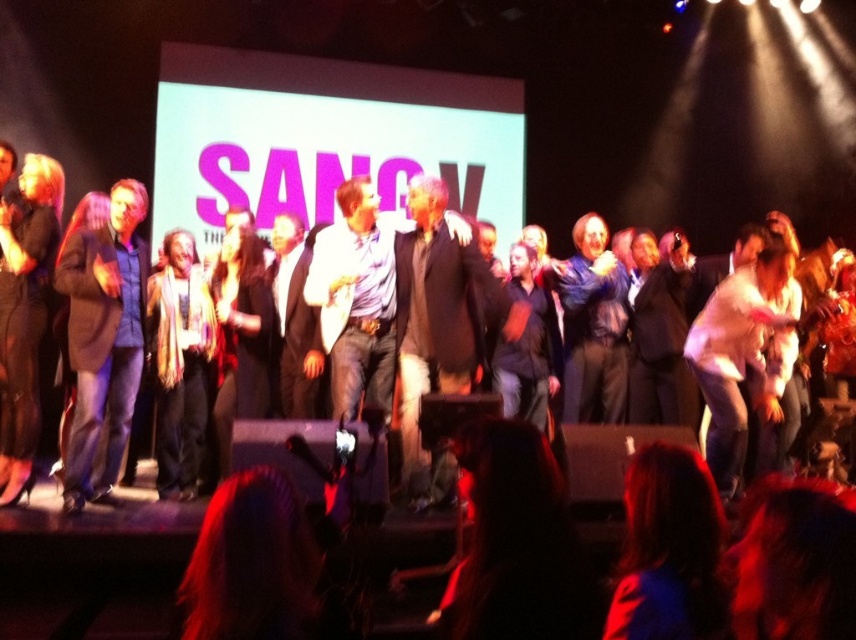
Can you confirm if black suit at center is bigger than dark blue jeans at center?

Yes.

Does black suit at center have a lesser height compared to dark blue jeans at center?

In fact, black suit at center may be taller than dark blue jeans at center.

Who is more forward, (280, 296) or (547, 378)?

Positioned in front is point (280, 296).

The image size is (856, 640). Find the location of `black suit at center`. black suit at center is located at coordinates (294, 321).

Between brown leather jacket at left and black suit at center, which one has more height?

Standing taller between the two is brown leather jacket at left.

Does brown leather jacket at left appear under black suit at center?

Yes, brown leather jacket at left is below black suit at center.

Image resolution: width=856 pixels, height=640 pixels. In order to click on brown leather jacket at left in this screenshot , I will do `click(103, 340)`.

Where is `brown leather jacket at left`? This screenshot has height=640, width=856. brown leather jacket at left is located at coordinates (103, 340).

Looking at this image, is dark hair at lower center thinner than brown leather jacket at left?

Incorrect, dark hair at lower center's width is not less than brown leather jacket at left's.

Is dark hair at lower center bigger than brown leather jacket at left?

No.

Does point (479, 445) come closer to viewer compared to point (107, 275)?

Yes, it is.

Find the location of `dark hair at lower center`. dark hair at lower center is located at coordinates (516, 544).